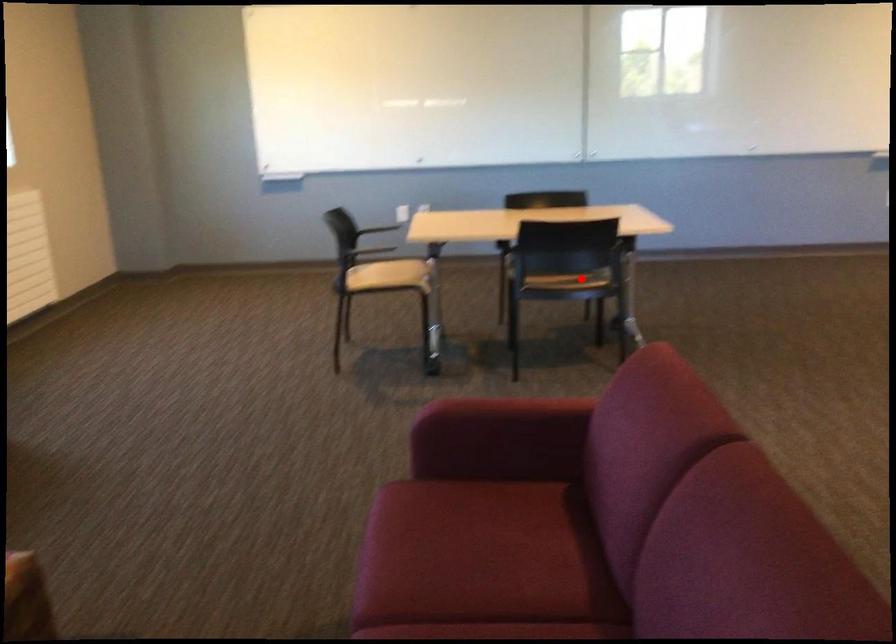
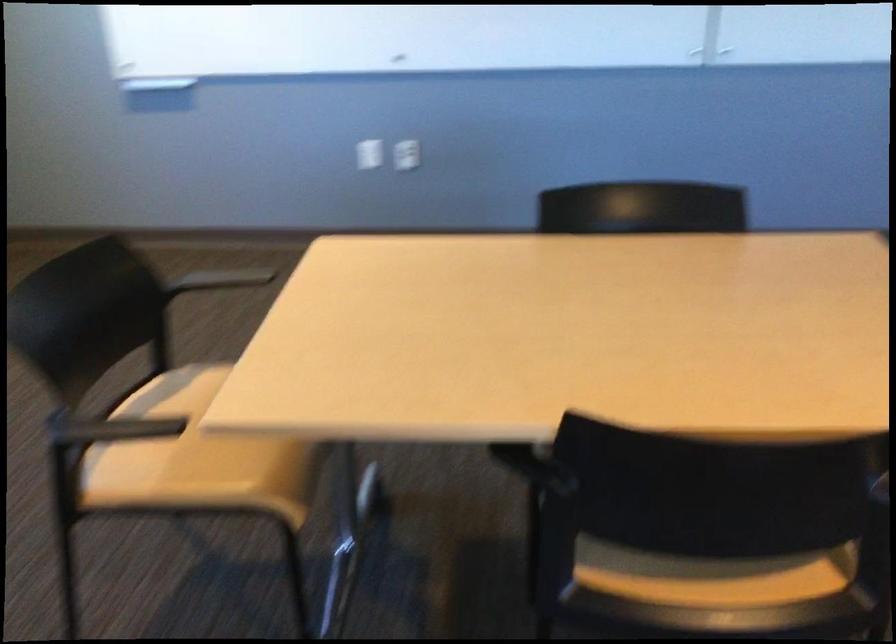
Question: I am providing you with two images of the same scene from different viewpoints. Image1 has a red point marked. In image2, the corresponding 3D location appears at what relative position? Reply with the corresponding letter.

Choices:
 (A) Closer
 (B) Farther

Answer: (A)